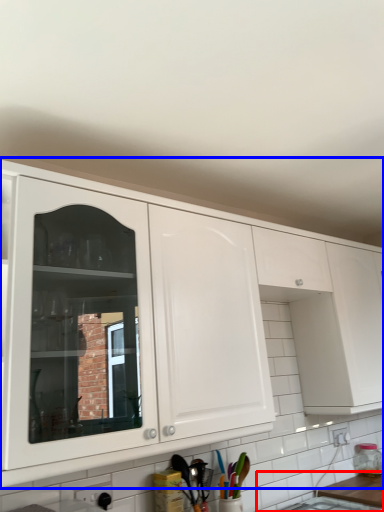
Question: Which object appears closest to the camera in this image, counter top (highlighted by a red box) or cabinetry (highlighted by a blue box)?

Choices:
 (A) counter top
 (B) cabinetry

Answer: (B)